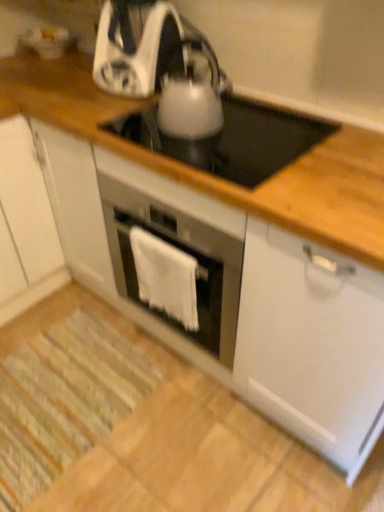
Question: Is white glossy kettle at upper center, arranged as the 2th kitchen appliance when viewed from the front, taller than white matte cabinet at left?

Choices:
 (A) yes
 (B) no

Answer: (B)

Question: Is white glossy kettle at upper center, acting as the first kitchen appliance starting from the back, directly adjacent to white matte cabinet at left?

Choices:
 (A) yes
 (B) no

Answer: (B)

Question: From the image's perspective, does white glossy kettle at upper center, acting as the first kitchen appliance starting from the back, appear lower than white matte cabinet at left?

Choices:
 (A) yes
 (B) no

Answer: (B)

Question: From the image's perspective, does white glossy kettle at upper center, arranged as the 2th kitchen appliance when viewed from the front, appear higher than white matte cabinet at left?

Choices:
 (A) no
 (B) yes

Answer: (B)

Question: Is white glossy kettle at upper center, arranged as the 2th kitchen appliance when viewed from the front, further to the viewer compared to white matte cabinet at left?

Choices:
 (A) yes
 (B) no

Answer: (A)

Question: Is the depth of white glossy kettle at upper center, arranged as the 2th kitchen appliance when viewed from the front, less than that of white matte cabinet at left?

Choices:
 (A) yes
 (B) no

Answer: (B)

Question: Is white matte cabinet at left facing away from white glossy kettle at upper center, acting as the first kitchen appliance starting from the back?

Choices:
 (A) yes
 (B) no

Answer: (B)

Question: Does white matte cabinet at left lie behind white glossy kettle at upper center, acting as the first kitchen appliance starting from the back?

Choices:
 (A) no
 (B) yes

Answer: (A)

Question: Does white matte cabinet at left appear on the left side of white glossy kettle at upper center, arranged as the 2th kitchen appliance when viewed from the front?

Choices:
 (A) no
 (B) yes

Answer: (B)

Question: Are white matte cabinet at left and white glossy kettle at upper center, acting as the first kitchen appliance starting from the back, making contact?

Choices:
 (A) yes
 (B) no

Answer: (B)

Question: Considering the relative sizes of white matte cabinet at left and white glossy kettle at upper center, arranged as the 2th kitchen appliance when viewed from the front, in the image provided, is white matte cabinet at left thinner than white glossy kettle at upper center, arranged as the 2th kitchen appliance when viewed from the front,?

Choices:
 (A) no
 (B) yes

Answer: (A)

Question: From a real-world perspective, is white matte cabinet at left physically below white glossy kettle at upper center, arranged as the 2th kitchen appliance when viewed from the front?

Choices:
 (A) no
 (B) yes

Answer: (B)

Question: Is white glossy electric kettle at center positioned in front of white fabric towel at center?

Choices:
 (A) yes
 (B) no

Answer: (A)